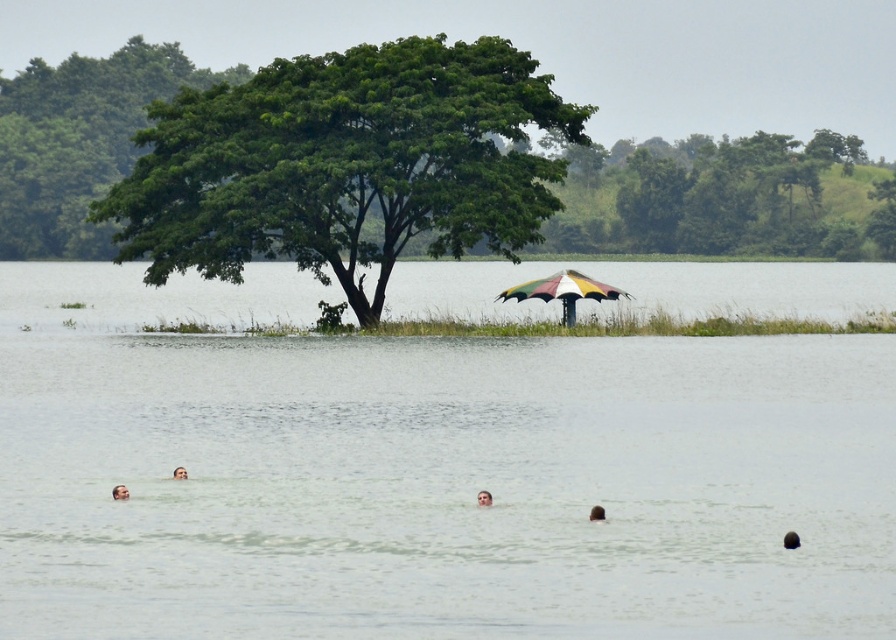
You are planning to set up a small boat in the clear water at umbrella center. Considering the height of the green leafy tree at center, will the tree obstruct the boat from sailing under it?

The clear water at umbrella center is not as tall as the green leafy tree at center, so the tree is taller. Therefore, the tree will obstruct the boat from sailing under it.

You are a photographer standing at the lakeside and want to take a photo of the brown hair at upper center and the clear water at umbrella center. The camera you have can focus on objects up to 50 meters away. Will both subjects be in focus?

The distance between the brown hair at upper center and the clear water at umbrella center is 49.33 meters, which is within the camera focus range of 50 meters. Therefore, both subjects will be in focus.